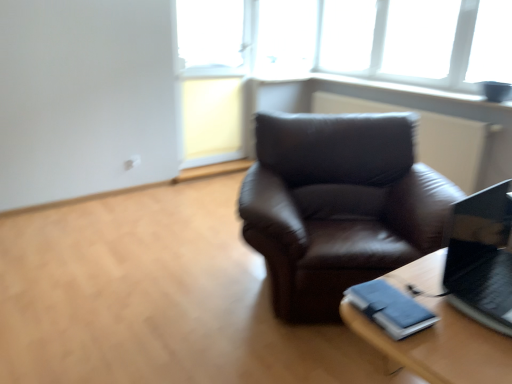
Find the location of a particular element. This screenshot has width=512, height=384. free spot behind blue fabric binder at lower right is located at coordinates (402, 278).